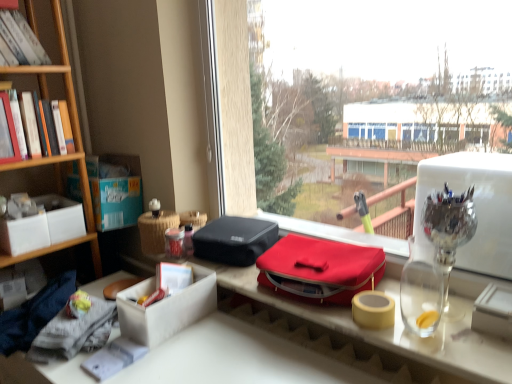
Question: Should I look upward or downward to see transparent glass pen holder at upper right?

Choices:
 (A) up
 (B) down

Answer: (B)

Question: Would you say transparent glass pen holder at upper right is part of hardcover book at left's contents?

Choices:
 (A) yes
 (B) no

Answer: (B)

Question: Considering the relative sizes of hardcover book at left and transparent glass pen holder at upper right in the image provided, is hardcover book at left bigger than transparent glass pen holder at upper right?

Choices:
 (A) yes
 (B) no

Answer: (B)

Question: Is hardcover book at left shorter than transparent glass pen holder at upper right?

Choices:
 (A) yes
 (B) no

Answer: (A)

Question: Is the depth of hardcover book at left less than that of transparent glass pen holder at upper right?

Choices:
 (A) no
 (B) yes

Answer: (A)

Question: Is hardcover book at left at the right side of transparent glass pen holder at upper right?

Choices:
 (A) no
 (B) yes

Answer: (A)

Question: Considering the relative sizes of hardcover book at left and transparent glass pen holder at upper right in the image provided, is hardcover book at left wider than transparent glass pen holder at upper right?

Choices:
 (A) yes
 (B) no

Answer: (B)

Question: Is yellow matte adhesive tape at right at the right side of transparent glass pen holder at upper right?

Choices:
 (A) yes
 (B) no

Answer: (B)

Question: From a real-world perspective, is yellow matte adhesive tape at right over transparent glass pen holder at upper right?

Choices:
 (A) yes
 (B) no

Answer: (B)

Question: Can you confirm if yellow matte adhesive tape at right is shorter than transparent glass pen holder at upper right?

Choices:
 (A) no
 (B) yes

Answer: (B)

Question: Is yellow matte adhesive tape at right located outside transparent glass pen holder at upper right?

Choices:
 (A) no
 (B) yes

Answer: (B)

Question: From the image's perspective, would you say yellow matte adhesive tape at right is positioned over transparent glass pen holder at upper right?

Choices:
 (A) yes
 (B) no

Answer: (B)

Question: Does yellow matte adhesive tape at right have a smaller size compared to transparent glass pen holder at upper right?

Choices:
 (A) yes
 (B) no

Answer: (A)

Question: Is transparent glass window at center smaller than hardcover book at left?

Choices:
 (A) no
 (B) yes

Answer: (A)